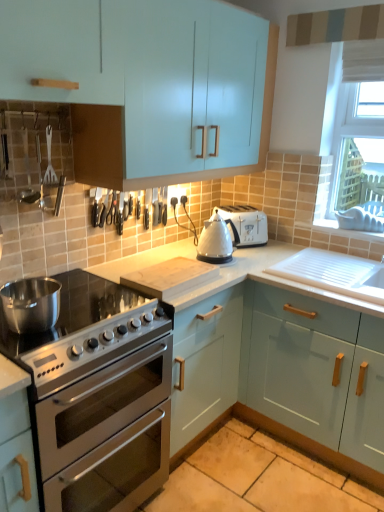
Identify the location of free space to the right of white glossy kettle at center, the second appliance ordered from the bottom. The width and height of the screenshot is (384, 512). point(255,260).